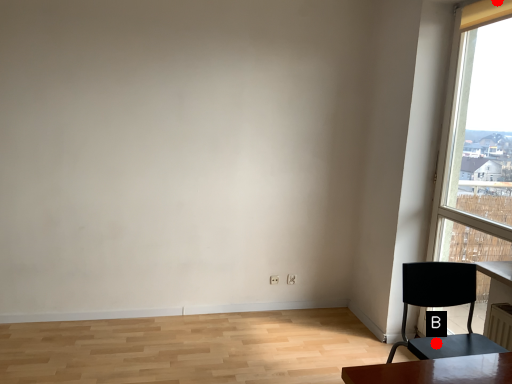
Question: Two points are circled on the image, labeled by A and B beside each circle. Which point is farther from the camera taking this photo?

Choices:
 (A) A is further
 (B) B is further

Answer: (A)